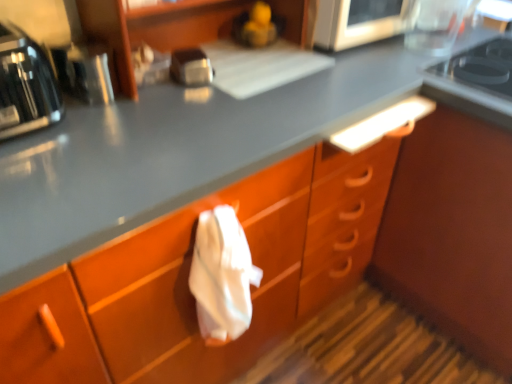
You are a GUI agent. You are given a task and a screenshot of the screen. Output one action in this format:
    pyautogui.click(x=<x>, y=<y>)
    Task: Click on the vacant space that's between shiny black toaster at left and metallic silver toaster at left, which ranks as the second appliance in right-to-left order
    This screenshot has width=512, height=384.
    Given the screenshot: What is the action you would take?
    pyautogui.click(x=78, y=107)